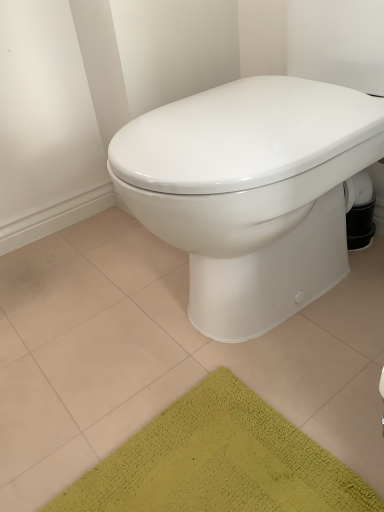
This screenshot has width=384, height=512. In order to click on vacant space in front of white glossy toilet at center in this screenshot , I will do `click(278, 404)`.